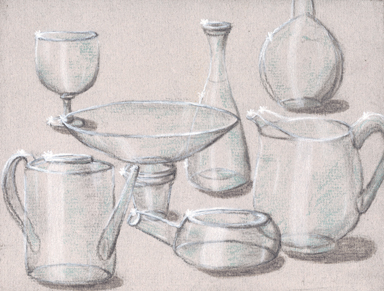
Locate an element on the screen. cup is located at coordinates (69, 67).